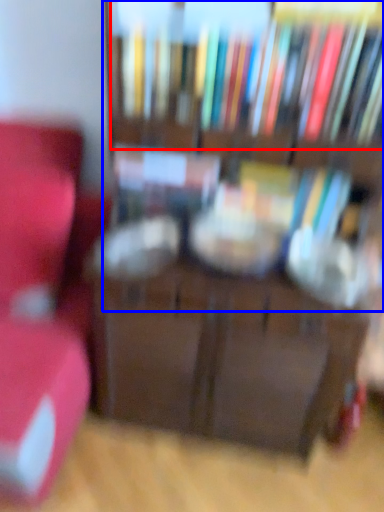
Question: Which object appears farthest to the camera in this image, book (highlighted by a red box) or bookcase (highlighted by a blue box)?

Choices:
 (A) book
 (B) bookcase

Answer: (A)